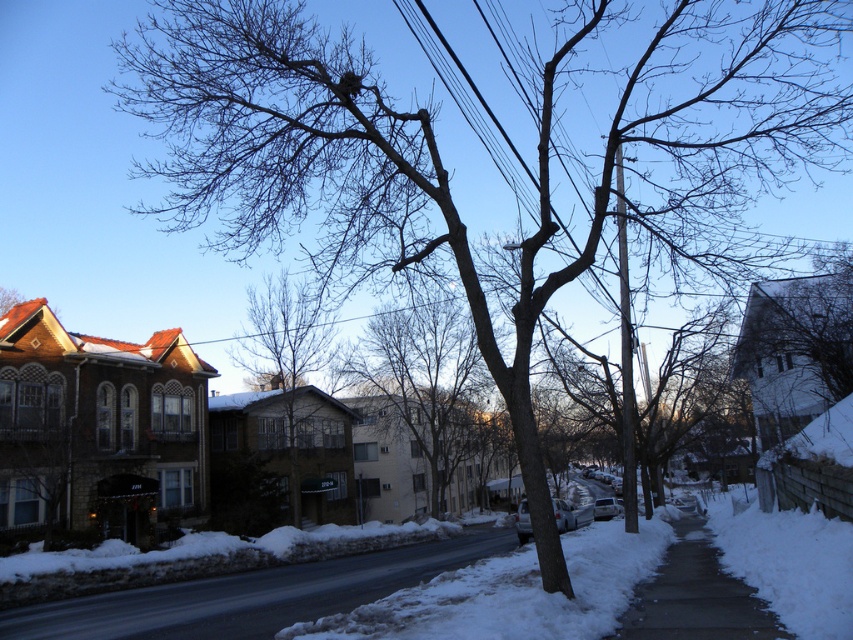
You are standing at the center of the image and want to walk towards the bare branches at center. In which direction should you move?

The bare branches at center are located at coordinates point (422, 410), so you should move to the right and slightly forward to reach them.

You are a delivery person trying to deliver a package to the brown textured building at center. You are currently standing near the bare branches at center. Can you walk directly towards the building without crossing the street?

The distance between the bare branches at center and the brown textured building at center is 38.65 feet. Since the street is in the center and you are on the sidewalk near the tree, you would need to cross the street to reach the building, so you cannot walk directly without crossing the street.